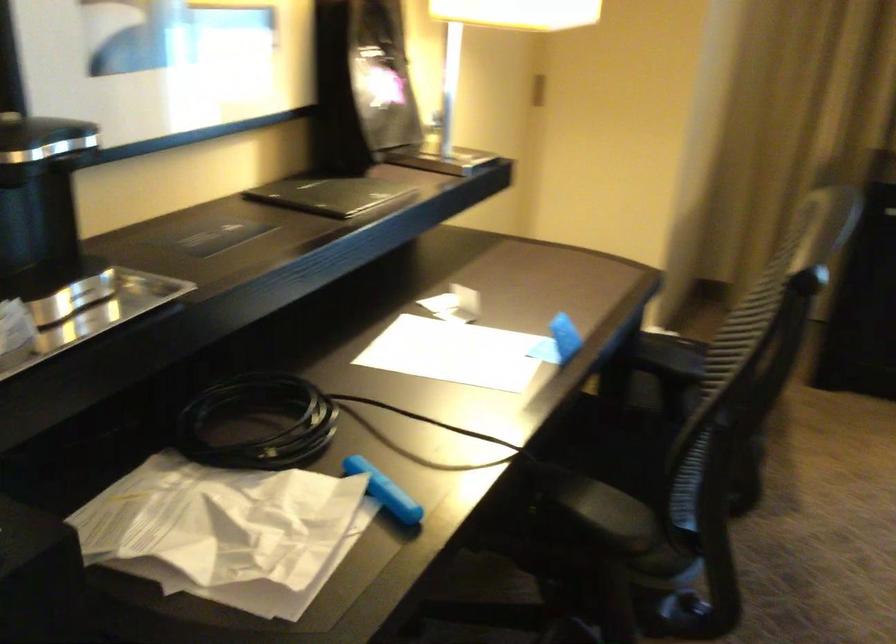
Where would you open the black menu book? Please return your answer as a coordinate pair (x, y).

(331, 194)